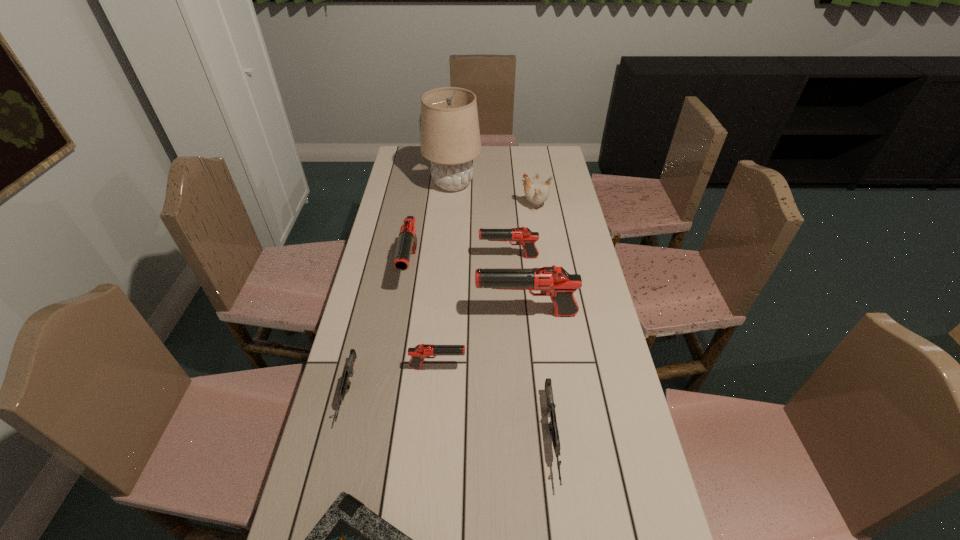
Locate an element on the screen. Image resolution: width=960 pixels, height=540 pixels. bird that is at the right edge is located at coordinates (536, 192).

What are the coordinates of `object that is positioned at the far left corner` in the screenshot? It's located at (450, 137).

Identify the location of vacant region at the far edge. The image size is (960, 540). (516, 148).

Where is `free space at the left edge of the desktop`? free space at the left edge of the desktop is located at coordinates (378, 475).

The width and height of the screenshot is (960, 540). I want to click on free space at the right edge of the desktop, so click(589, 374).

Identify the location of unoccupied area between the bird and the leftmost black gun. This screenshot has height=540, width=960. (472, 237).

This screenshot has width=960, height=540. Find the location of `vacant region between the second shortest object and the lampshade`. vacant region between the second shortest object and the lampshade is located at coordinates (400, 288).

Locate an element on the screen. This screenshot has width=960, height=540. empty location between the right grey gun and the smaller grey gun is located at coordinates (450, 414).

This screenshot has height=540, width=960. I want to click on free space that is in between the leftmost black gun and the third tallest gun, so click(x=460, y=262).

The width and height of the screenshot is (960, 540). Find the location of `vacant space that's between the second gun from left to right and the third shortest object`. vacant space that's between the second gun from left to right and the third shortest object is located at coordinates (481, 353).